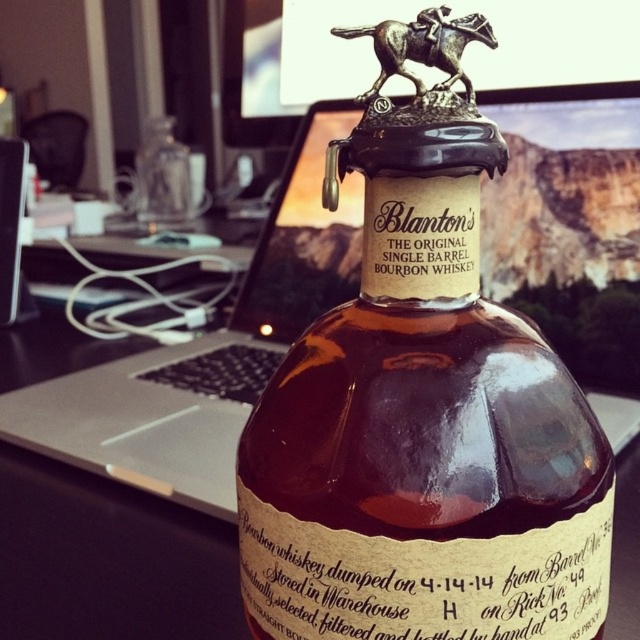
Question: In this image, where is metallic horse trophy at upper center located relative to matte glass bottle at center?

Choices:
 (A) right
 (B) left

Answer: (A)

Question: Which object appears closest to the camera in this image?

Choices:
 (A) brown glass bottle at center
 (B) bronze/textured horse at top

Answer: (A)

Question: Can you confirm if bronze/textured horse at top is positioned above matte glass bottle at center?

Choices:
 (A) no
 (B) yes

Answer: (A)

Question: Can you confirm if silver metallic laptop at center is positioned above bronze/textured horse at top?

Choices:
 (A) yes
 (B) no

Answer: (B)

Question: Which of the following is the farthest from the observer?

Choices:
 (A) (144, 161)
 (B) (308, 620)

Answer: (A)

Question: Which object appears farthest from the camera in this image?

Choices:
 (A) brown glass bottle at center
 (B) silver metallic laptop at center
 (C) bronze/textured horse at top
 (D) matte glass bottle at center

Answer: (D)